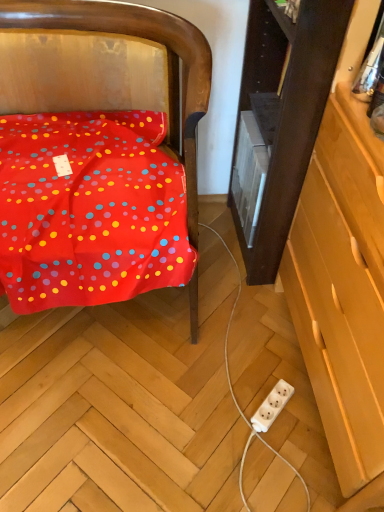
Describe the element at coordinates (272, 406) in the screenshot. I see `white plastic power strip at lower center` at that location.

Find the location of a particular element. This screenshot has height=512, width=384. white plastic power strip at lower center is located at coordinates (272, 406).

What is the approximate height of white plastic power strip at lower center?

It is 1.60 inches.

What are the coordinates of `white plastic power strip at lower center` in the screenshot? It's located at (272, 406).